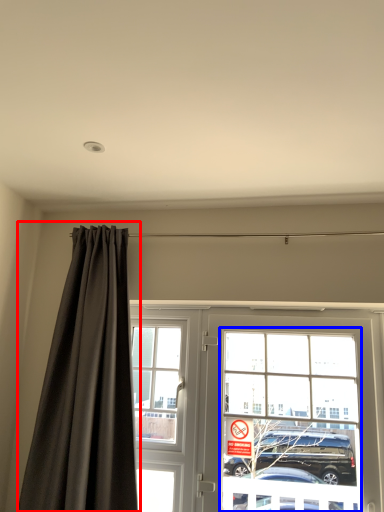
Question: Among these objects, which one is farthest to the camera, curtain (highlighted by a red box) or bay window (highlighted by a blue box)?

Choices:
 (A) curtain
 (B) bay window

Answer: (B)